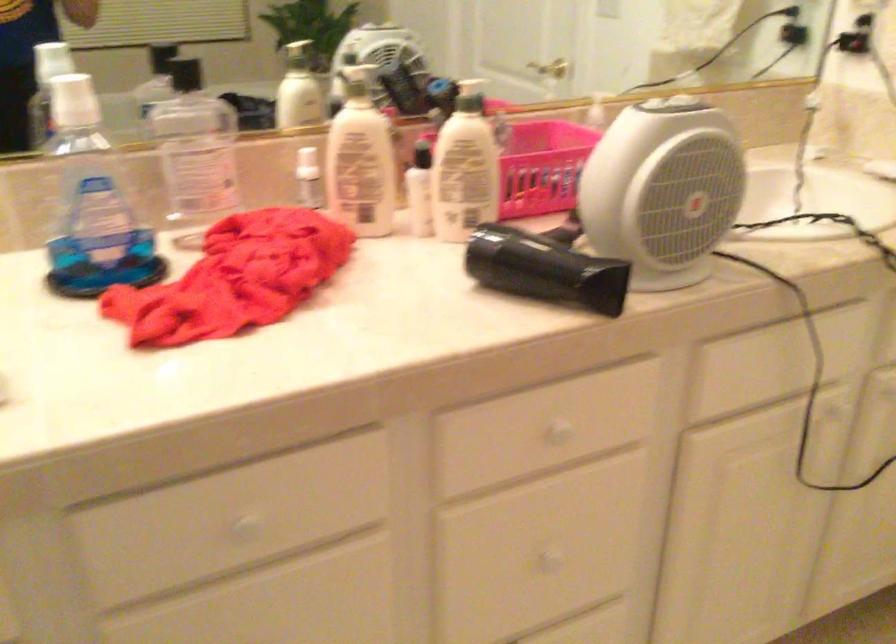
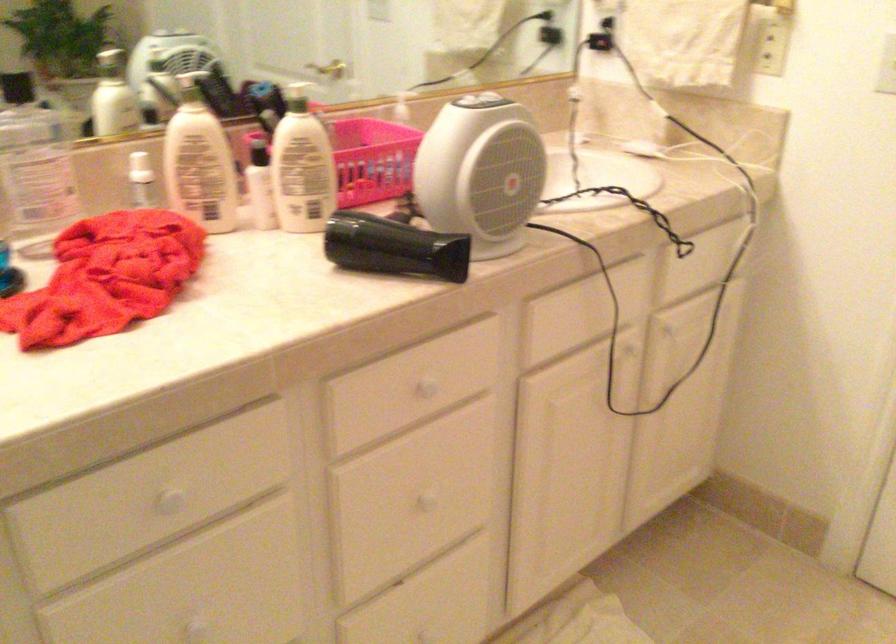
Find the pixel in the second image that matches (x=462, y=97) in the first image.

(297, 100)